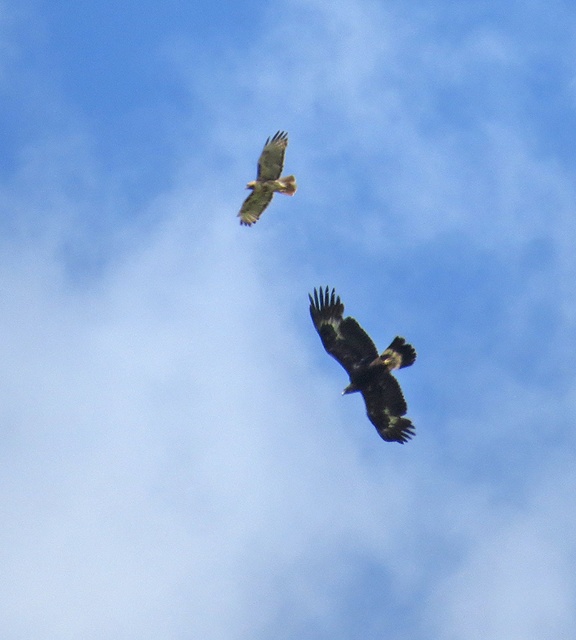
From the picture: You are a birdwatcher observing two birds in the sky. You notice the dark brown feathers at center and the brown feathered eagle at upper center. Which bird is closer to you?

The dark brown feathers at center is closer to you because it is in front of the brown feathered eagle at upper center.

You are a birdwatcher observing two birds in the sky. You notice the dark brown feathers at center and the brown feathered eagle at upper center. Which of these two birds appears taller in the sky?

The dark brown feathers at center appears taller than the brown feathered eagle at upper center.